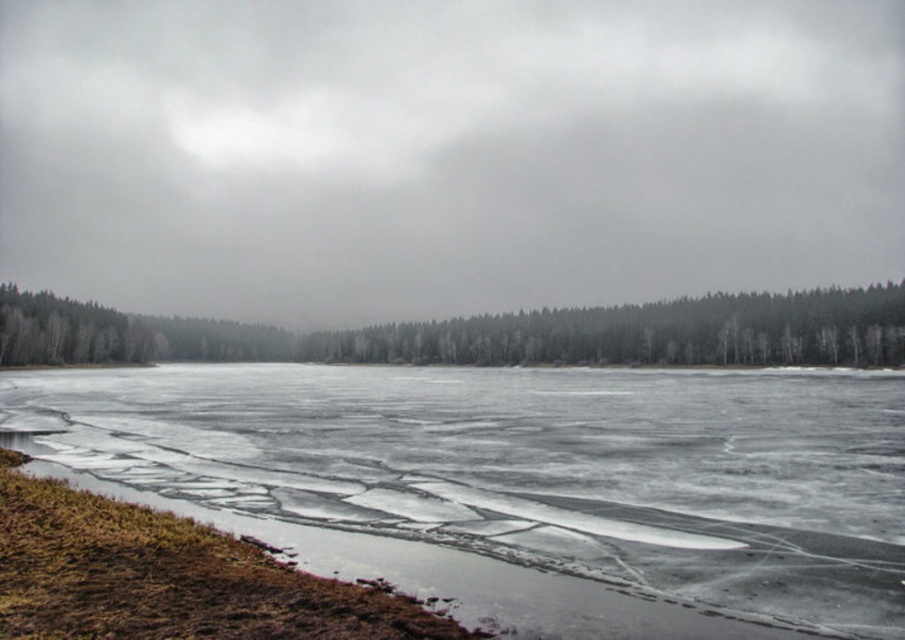
Does translucent ice at lower left have a greater height compared to green matte trees at center?

No.

Does translucent ice at lower left have a smaller size compared to green matte trees at center?

Correct, translucent ice at lower left occupies less space than green matte trees at center.

Between point (460, 444) and point (594, 326), which one is positioned in front?

Point (460, 444) is more forward.

Where is `translucent ice at lower left`? Image resolution: width=905 pixels, height=640 pixels. translucent ice at lower left is located at coordinates (521, 483).